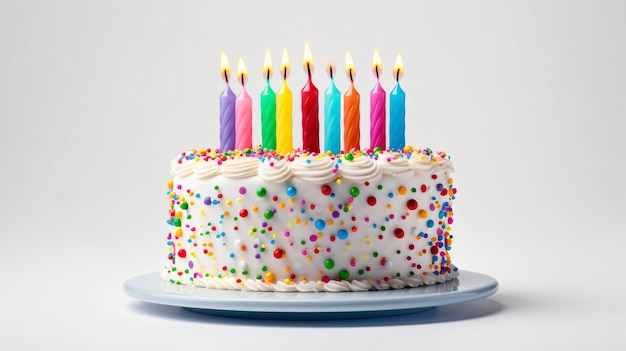
Locate an element on the screen. The image size is (626, 351). candles is located at coordinates (223, 114), (245, 115), (273, 115), (285, 121), (312, 121), (332, 121), (352, 121), (382, 121), (402, 120).